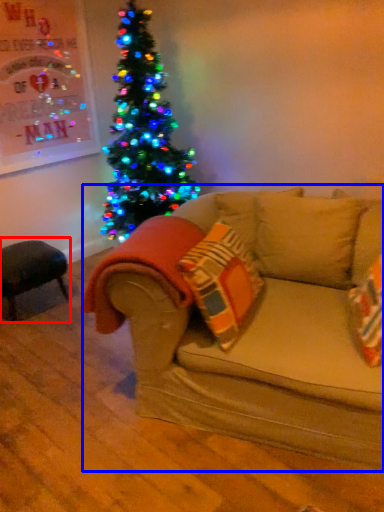
Question: Which object is further to the camera taking this photo, swivel chair (highlighted by a red box) or studio couch (highlighted by a blue box)?

Choices:
 (A) swivel chair
 (B) studio couch

Answer: (A)